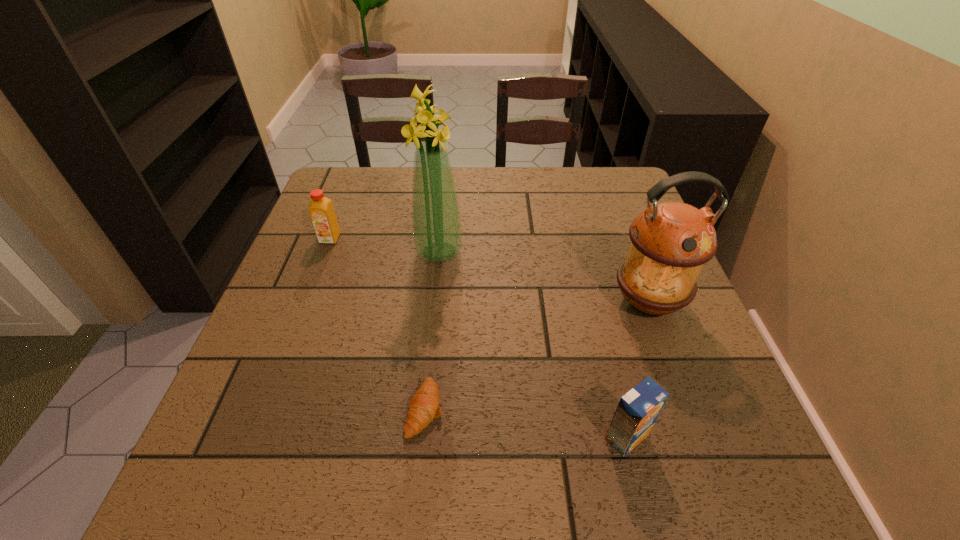
At what (x,y) coordinates should I click in order to perform the action: click on vacant point located between the nearer orange_juice and the left orange_juice. Please return your answer as a coordinate pair (x, y). This screenshot has height=540, width=960. Looking at the image, I should click on (478, 338).

At what (x,y) coordinates should I click in order to perform the action: click on object that stands as the fourth closest to the bouquet. Please return your answer as a coordinate pair (x, y). Looking at the image, I should click on (637, 411).

The image size is (960, 540). In order to click on object that is the fourth closest to the left orange_juice in this screenshot , I will do `click(637, 411)`.

Find the location of `vacant point that satisfies the following two spatial constraints: 1. on the front-facing side of the tallest object; 2. on the back side of the third farthest object`. vacant point that satisfies the following two spatial constraints: 1. on the front-facing side of the tallest object; 2. on the back side of the third farthest object is located at coordinates (434, 302).

Identify the location of vacant space that satisfies the following two spatial constraints: 1. on the front-facing side of the rightmost object; 2. on the left side of the tallest object. This screenshot has height=540, width=960. (434, 302).

The image size is (960, 540). In order to click on blank area in the image that satisfies the following two spatial constraints: 1. on the front-facing side of the fourth shortest object; 2. on the left side of the bouquet in this screenshot , I will do `click(434, 302)`.

Find the location of `free space that satisfies the following two spatial constraints: 1. on the front-facing side of the bouquet; 2. on the back side of the second tallest object`. free space that satisfies the following two spatial constraints: 1. on the front-facing side of the bouquet; 2. on the back side of the second tallest object is located at coordinates (434, 302).

Where is `vacant area that satisfies the following two spatial constraints: 1. on the front and back of the farther orange_juice; 2. on the left side of the crescent roll`? This screenshot has width=960, height=540. vacant area that satisfies the following two spatial constraints: 1. on the front and back of the farther orange_juice; 2. on the left side of the crescent roll is located at coordinates [x=264, y=409].

Find the location of a particular element. The width and height of the screenshot is (960, 540). free location that satisfies the following two spatial constraints: 1. on the front and back of the leftmost object; 2. on the right side of the second object from right to left is located at coordinates 253,437.